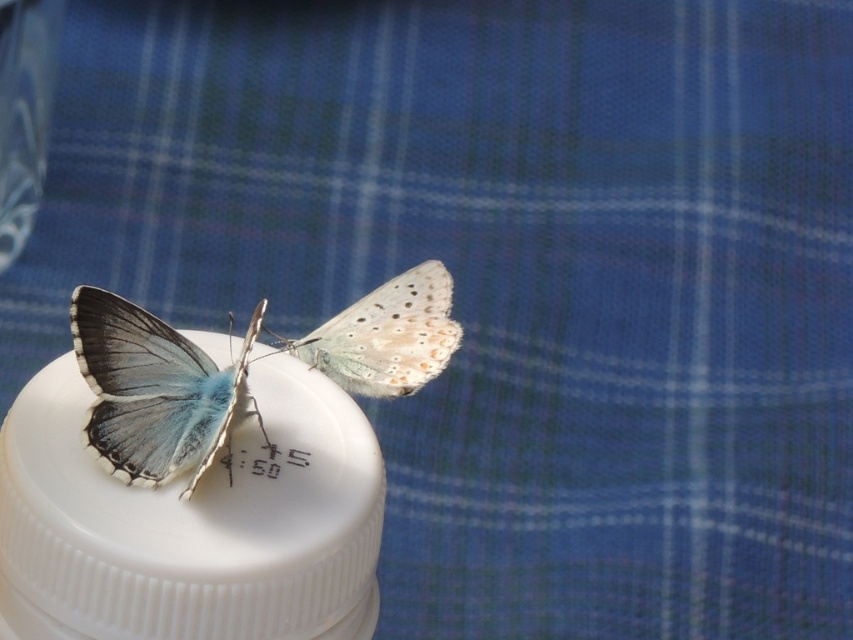
Between matte blue butterfly at center and translucent white butterfly at center, which one has more height?

With more height is matte blue butterfly at center.

Is matte blue butterfly at center smaller than translucent white butterfly at center?

No, matte blue butterfly at center is not smaller than translucent white butterfly at center.

Is point (178, 403) less distant than point (403, 388)?

Yes, point (178, 403) is closer to viewer.

The height and width of the screenshot is (640, 853). In order to click on matte blue butterfly at center in this screenshot , I will do `click(154, 390)`.